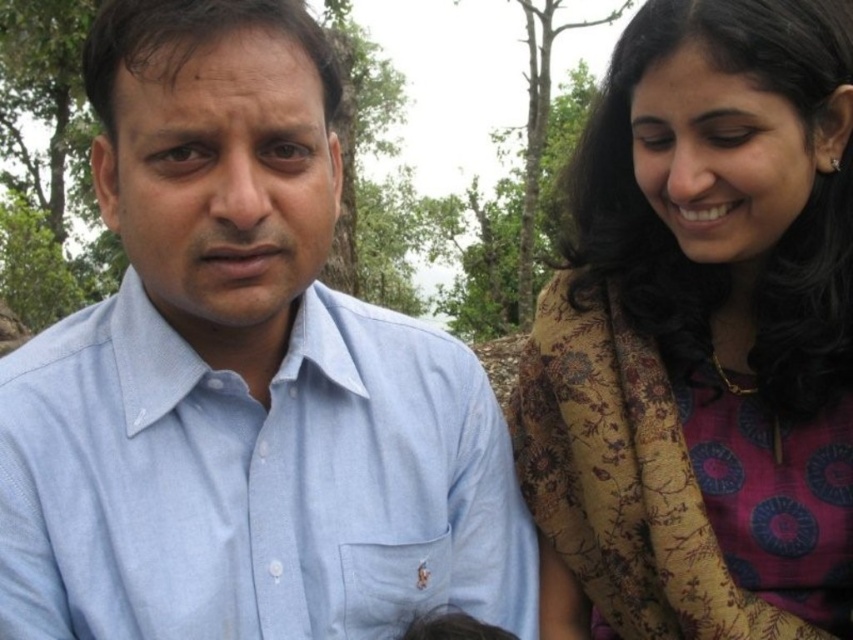
You are standing in a natural setting with two people. You need to locate the light blue cotton shirt at center. Based on its coordinates, which direction should you face to ensure it is directly in front of you?

The light blue cotton shirt at center is located at point (241, 378), which means it is positioned slightly to the right and above the center of the image. To face it directly, you should adjust your direction to aim towards the upper right quadrant of your view.

You are standing in a natural setting with two people in front of you. You see the light blue cotton shirt at center. Can you reach out and touch it without moving your feet?

The light blue cotton shirt at center is 3.38 meters away from viewer, so no, you cannot reach it without moving your feet since the distance is too far.

You are standing in a natural setting with two people. There is a point at coordinates (241,378). What object is located at that point?

The light blue cotton shirt at center is located at point (241,378).